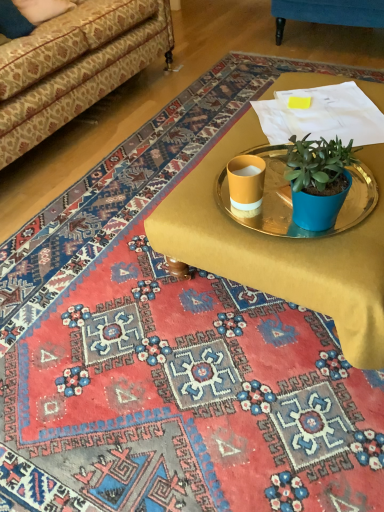
Measure the distance between metallic gold tray at center and camera.

metallic gold tray at center is 1.07 meters away from camera.

From the picture: In order to face matte yellow cup at center, should I rotate leftwards or rightwards?

→ You should rotate right by 7.109 degrees.

Describe the element at coordinates (282, 249) in the screenshot. The height and width of the screenshot is (512, 384). I see `gold metallic tray at center` at that location.

This screenshot has height=512, width=384. Identify the location of metallic gold tray at center. coord(291,198).

Does point (283, 297) lie in front of point (231, 191)?

Yes.

Is gold metallic tray at center bigger than matte yellow cup at center?

Yes.

Does gold metallic tray at center have a greater height compared to matte yellow cup at center?

Yes, gold metallic tray at center is taller than matte yellow cup at center.

Which of these two, gold metallic tray at center or matte yellow cup at center, is thinner?

matte yellow cup at center.

Considering the sizes of matte yellow cup at center and patterned fabric couch at upper left in the image, is matte yellow cup at center taller or shorter than patterned fabric couch at upper left?

Clearly, matte yellow cup at center is shorter compared to patterned fabric couch at upper left.

The image size is (384, 512). I want to click on coffee cup that is above the patterned fabric couch at upper left (from a real-world perspective), so click(x=246, y=184).

Can we say matte yellow cup at center lies outside patterned fabric couch at upper left?

matte yellow cup at center is positioned outside patterned fabric couch at upper left.

Between gold metallic tray at center and metallic gold tray at center, which one appears on the right side from the viewer's perspective?

gold metallic tray at center is more to the right.

Would you say metallic gold tray at center is part of gold metallic tray at center's contents?

Indeed, metallic gold tray at center is located within gold metallic tray at center.

Does gold metallic tray at center have a greater width compared to metallic gold tray at center?

Indeed, gold metallic tray at center has a greater width compared to metallic gold tray at center.

Which is behind, point (309, 304) or point (356, 196)?

The point (356, 196) is more distant.

Considering the relative sizes of metallic gold tray at center and patterned fabric couch at upper left in the image provided, is metallic gold tray at center wider than patterned fabric couch at upper left?

In fact, metallic gold tray at center might be narrower than patterned fabric couch at upper left.

From a real-world perspective, is metallic gold tray at center positioned over patterned fabric couch at upper left based on gravity?

No, from a real-world perspective, metallic gold tray at center is not over patterned fabric couch at upper left

How much distance is there between metallic gold tray at center and patterned fabric couch at upper left?

metallic gold tray at center and patterned fabric couch at upper left are 3.84 feet apart from each other.

Considering their positions, is matte yellow cup at center located in front of or behind gold metallic tray at center?

In the image, matte yellow cup at center appears behind gold metallic tray at center.

Who is bigger, matte yellow cup at center or gold metallic tray at center?

Bigger between the two is gold metallic tray at center.

From a real-world perspective, is matte yellow cup at center physically located above or below gold metallic tray at center?

In terms of real-world spatial position, matte yellow cup at center is above gold metallic tray at center.

I want to click on coffee cup behind the gold metallic tray at center, so click(246, 184).

Which of these two, matte yellow cup at center or metallic gold tray at center, stands taller?

Standing taller between the two is matte yellow cup at center.

Are matte yellow cup at center and metallic gold tray at center far apart?

No, there isn't a large distance between matte yellow cup at center and metallic gold tray at center.

Is point (248, 200) positioned after point (353, 223)?

Yes.

How much distance is there between matte yellow cup at center and metallic gold tray at center?

matte yellow cup at center is 4.24 inches away from metallic gold tray at center.

Measure the distance from metallic gold tray at center to matte yellow cup at center.

metallic gold tray at center is 4.24 inches from matte yellow cup at center.

Considering the relative positions of metallic gold tray at center and matte yellow cup at center in the image provided, is metallic gold tray at center to the right of matte yellow cup at center from the viewer's perspective?

Yes, metallic gold tray at center is to the right of matte yellow cup at center.

Does metallic gold tray at center have a greater height compared to matte yellow cup at center?

In fact, metallic gold tray at center may be shorter than matte yellow cup at center.

What's the angular difference between metallic gold tray at center and matte yellow cup at center's facing directions?

The facing directions of metallic gold tray at center and matte yellow cup at center are 4.48 degrees apart.

Where is `desk that appears below the matte yellow cup at center (from a real-world perspective)`? The image size is (384, 512). desk that appears below the matte yellow cup at center (from a real-world perspective) is located at coordinates (282, 249).

You are a GUI agent. You are given a task and a screenshot of the screen. Output one action in this format:
    pyautogui.click(x=<x>, y=<y>)
    Task: Click on the coffee cup above the patterned fabric couch at upper left (from a real-world perspective)
    
    Given the screenshot: What is the action you would take?
    pyautogui.click(x=246, y=184)

Based on their spatial positions, is matte yellow cup at center or metallic gold tray at center further from patterned fabric couch at upper left?

matte yellow cup at center lies further to patterned fabric couch at upper left than the other object.

From the image, which object appears to be farther from matte yellow cup at center, patterned fabric couch at upper left or gold metallic tray at center?

Based on the image, patterned fabric couch at upper left appears to be further to matte yellow cup at center.

Which object lies further to the anchor point patterned fabric couch at upper left, metallic gold tray at center or gold metallic tray at center?

Based on the image, metallic gold tray at center appears to be further to patterned fabric couch at upper left.

Estimate the real-world distances between objects in this image. Which object is further from gold metallic tray at center, metallic gold tray at center or matte yellow cup at center?

Answer: matte yellow cup at center is positioned further to the anchor gold metallic tray at center.

When comparing their distances from gold metallic tray at center, does metallic gold tray at center or patterned fabric couch at upper left seem closer?

The object closer to gold metallic tray at center is metallic gold tray at center.

Estimate the real-world distances between objects in this image. Which object is closer to matte yellow cup at center, patterned fabric couch at upper left or metallic gold tray at center?

metallic gold tray at center is positioned closer to the anchor matte yellow cup at center.

Which object lies nearer to the anchor point metallic gold tray at center, matte yellow cup at center or gold metallic tray at center?

Based on the image, matte yellow cup at center appears to be nearer to metallic gold tray at center.

Estimate the real-world distances between objects in this image. Which object is further from patterned fabric couch at upper left, matte yellow cup at center or gold metallic tray at center?

matte yellow cup at center lies further to patterned fabric couch at upper left than the other object.

Where is `coffee cup between patterned fabric couch at upper left and gold metallic tray at center from left to right`? This screenshot has height=512, width=384. coffee cup between patterned fabric couch at upper left and gold metallic tray at center from left to right is located at coordinates (246, 184).

Locate an element on the screen. The height and width of the screenshot is (512, 384). round table between matte yellow cup at center and gold metallic tray at center in the horizontal direction is located at coordinates (291, 198).

This screenshot has width=384, height=512. I want to click on coffee cup between patterned fabric couch at upper left and metallic gold tray at center in the horizontal direction, so click(246, 184).

Locate an element on the screen. The image size is (384, 512). round table between patterned fabric couch at upper left and gold metallic tray at center from left to right is located at coordinates (291, 198).